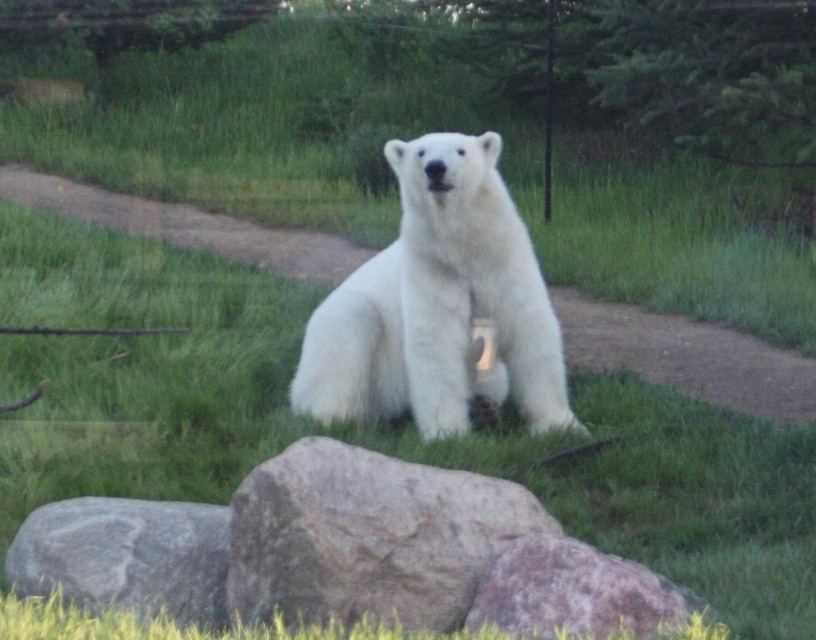
You are a zookeeper who needs to place a new feeding bowl for the polar bear. The bowl has a diameter of 12 inches. You have two rocks in the enclosure, the gray rough rock at center and gray rough rock at lower center. Can you safely place the bowl between them without it overlapping either rock?

The gray rough rock at center and gray rough rock at lower center are 13.33 inches apart. Since the bowl has a diameter of 12 inches, which is smaller than the distance between the rocks, you can safely place the bowl between them without overlapping either rock.

You are observing a polar bear in its enclosure. You notice two points marked in the scene. The first point is at coordinates point (x=481, y=198) and the second is at point (x=559, y=600). Which point is closer to you as you look at the image?

Point (x=559, y=600) is closer to you because it is less further to the camera than point (x=481, y=198), which is stated to be further away.

You are a zookeeper tasked with feeding the animals. You have a food tray that can hold up to 2 meters in width. You see the white fluffy bear at center and the gray rough rock at lower center. Can the food tray accommodate both objects side by side?

The white fluffy bear at center might be wider than gray rough rock at lower center. Since the combined width of both objects could exceed the tray capacity, it is uncertain if they can fit together. Please measure their actual widths first.